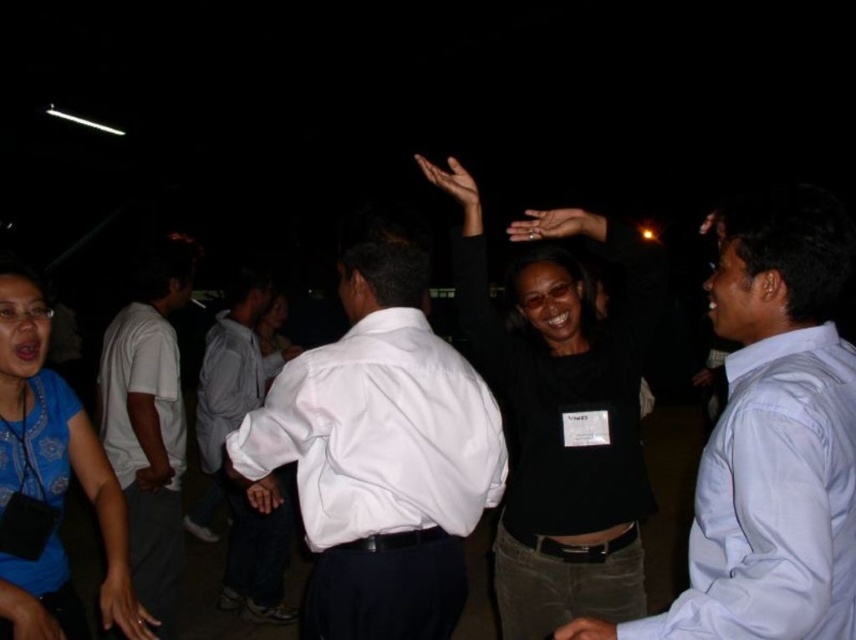
Looking at this image, is black matte hand at center to the right of brown matte hand at upper center from the viewer's perspective?

Yes, black matte hand at center is to the right of brown matte hand at upper center.

This screenshot has width=856, height=640. What are the coordinates of `black matte hand at center` in the screenshot? It's located at (556, 225).

Is point (835, 362) positioned behind point (37, 522)?

That is False.

Can you confirm if light blue shirt at right is positioned to the right of blue printed shirt at lower left?

Yes, light blue shirt at right is to the right of blue printed shirt at lower left.

Identify the location of light blue shirt at right. This screenshot has width=856, height=640. (776, 436).

Is white cotton shirt at left wider than white cotton shirt at center?

Incorrect, white cotton shirt at left's width does not surpass white cotton shirt at center's.

Can you confirm if white cotton shirt at left is thinner than white cotton shirt at center?

Yes, white cotton shirt at left is thinner than white cotton shirt at center.

Where is `white cotton shirt at left`? The height and width of the screenshot is (640, 856). white cotton shirt at left is located at coordinates (147, 422).